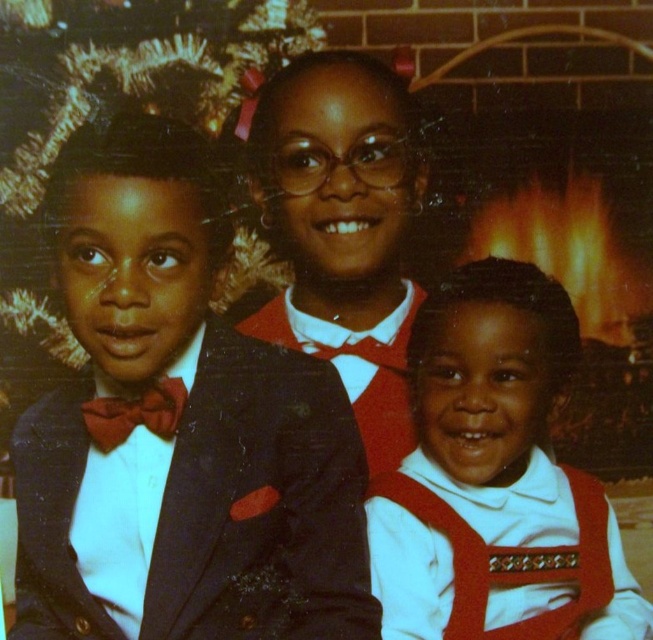
Question: Which point appears farthest from the camera in this image?

Choices:
 (A) click(x=155, y=390)
 (B) click(x=353, y=337)

Answer: (B)

Question: Does matte black suit at left appear over matte red bow tie at left?

Choices:
 (A) yes
 (B) no

Answer: (A)

Question: Among these points, which one is farthest from the camera?

Choices:
 (A) (518, 589)
 (B) (263, 339)
 (C) (362, 540)

Answer: (B)

Question: Is matte red vest at lower right above matte black vest at center?

Choices:
 (A) yes
 (B) no

Answer: (B)

Question: Is matte black suit at left below matte red vest at lower right?

Choices:
 (A) yes
 (B) no

Answer: (B)

Question: Which point appears closest to the camera in this image?

Choices:
 (A) (123, 420)
 (B) (421, 440)
 (C) (22, 465)

Answer: (A)